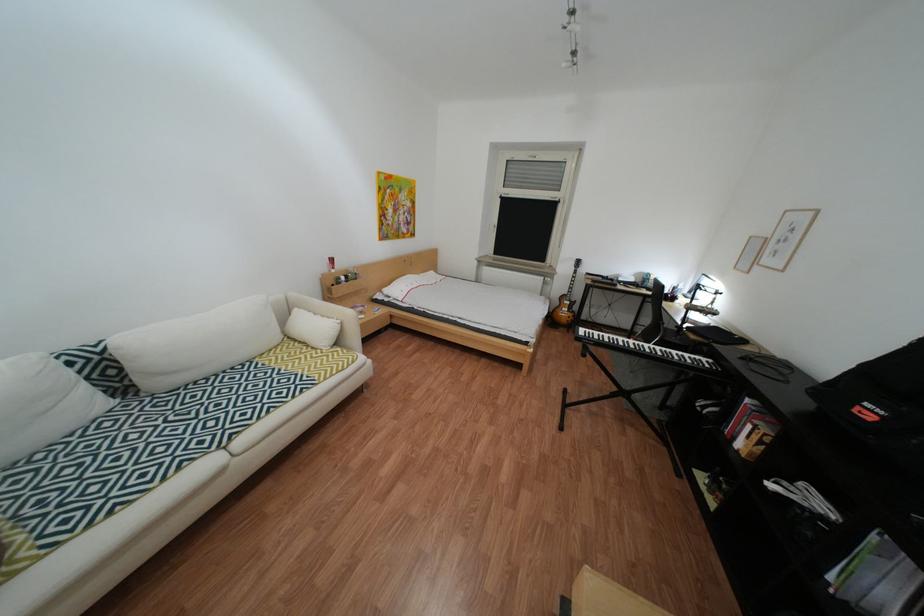
The width and height of the screenshot is (924, 616). What do you see at coordinates (126, 454) in the screenshot?
I see `the sofa sitting surface` at bounding box center [126, 454].